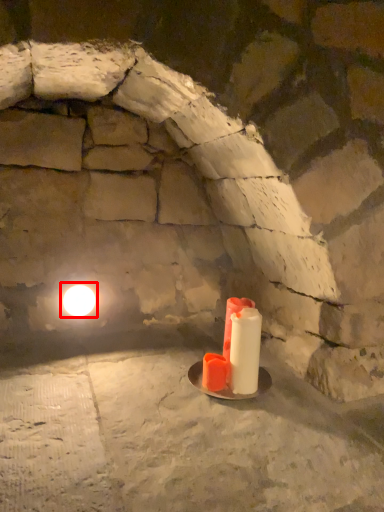
Question: Where is light (annotated by the red box) located in relation to candle in the image?

Choices:
 (A) left
 (B) right

Answer: (A)